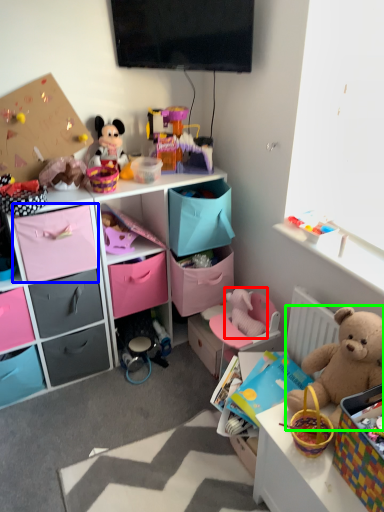
Question: Considering the real-world distances, which object is farthest from toy (highlighted by a red box)? drawer (highlighted by a blue box) or teddy bear (highlighted by a green box)?

Choices:
 (A) drawer
 (B) teddy bear

Answer: (A)